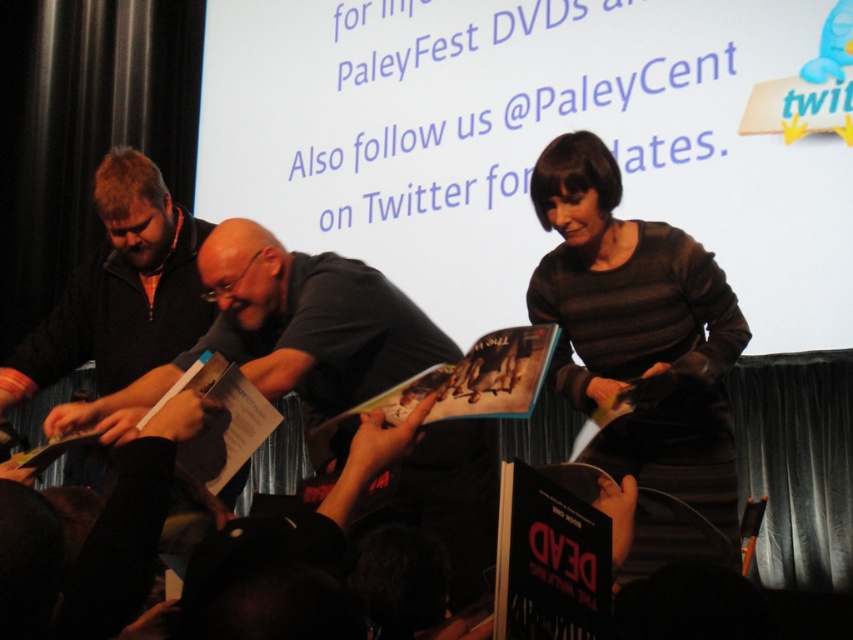
You are attending PaleyFest and want to take a photo of the autograph session. The dark gray shirt at center and the white paper book at center are both in your frame. Which object should you focus on if you want to capture the wider one?

The dark gray shirt at center might be wider than white paper book at center, so you should focus on the dark gray shirt at center to capture the wider object.

You are attending the PaleyFest event and want to get an autograph. You are standing at point A, which is at coordinates point [421,326]. The autograph table is at point B, coordinates point [233,428]. Can you walk directly from point A to point B without moving around any obstacles?

Point [421,326] is behind point [233,428], so you cannot walk directly from point A to point B without moving around obstacles.

You are standing at the point marked by the coordinate point at point (268, 362). You want to walk to the PaleyFest screen in the background. Is there enough space to walk straight ahead without obstacles?

The distance between you and the PaleyFest screen in the background is 17.45 meters, so yes, there is enough space to walk straight ahead without obstacles.